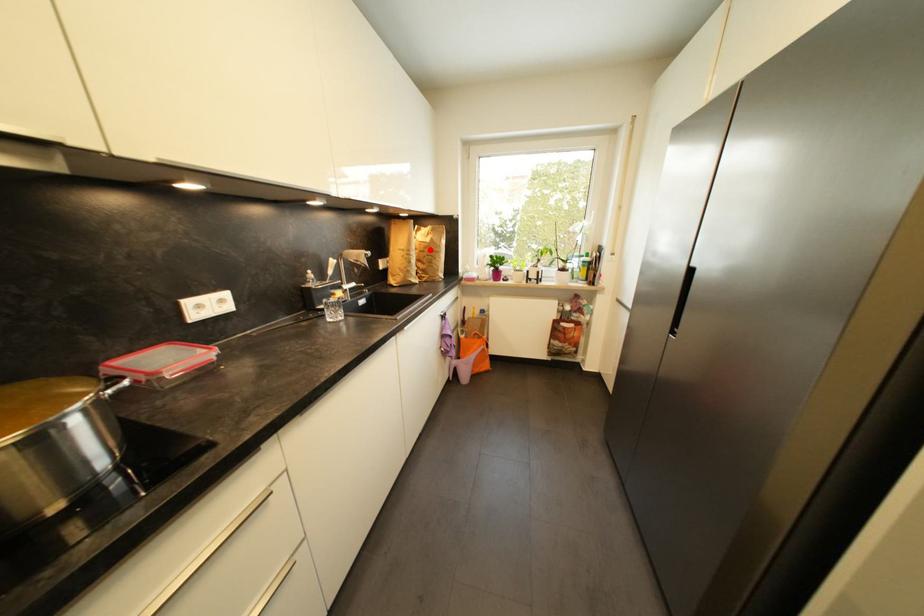
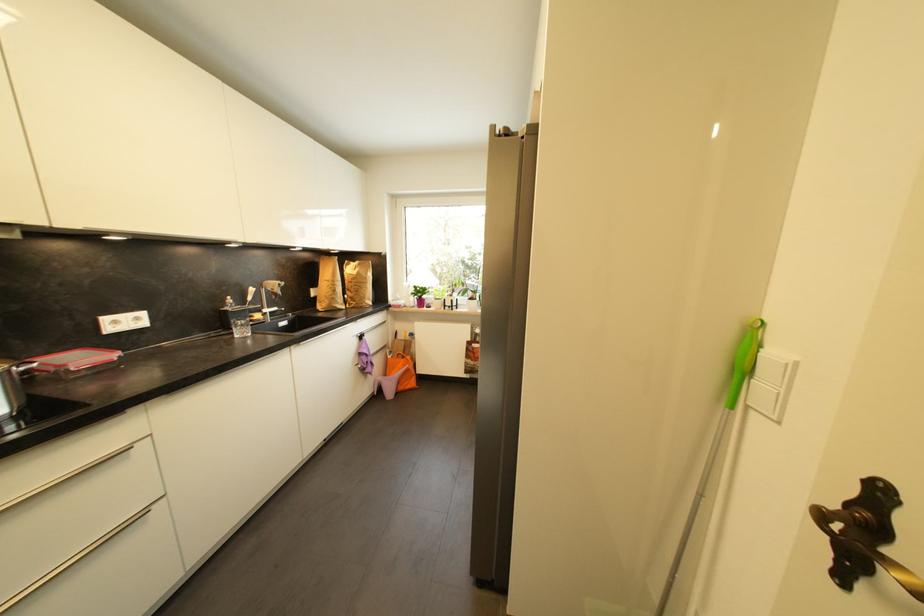
The point at the highlighted location is marked in the first image. Where is the corresponding point in the second image?

(358, 281)